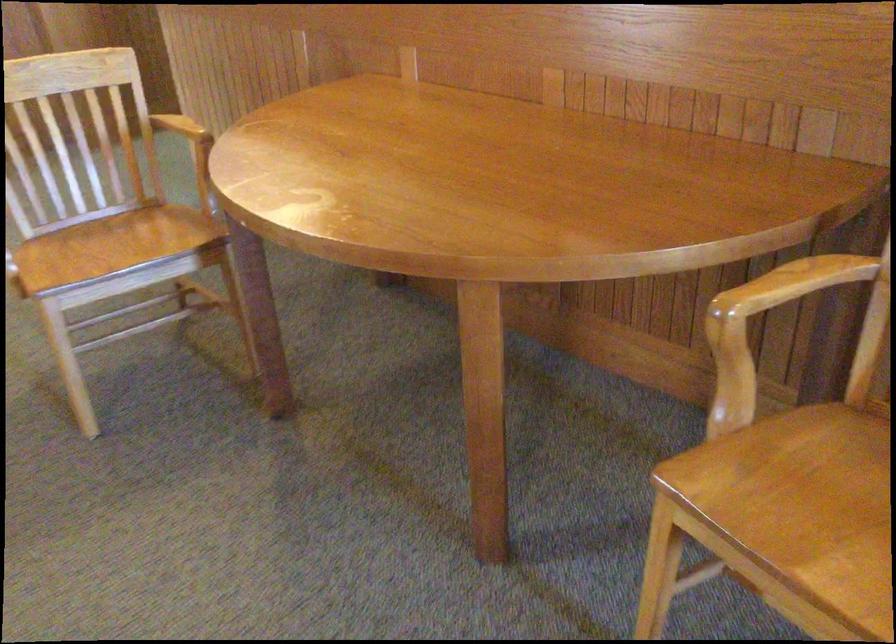
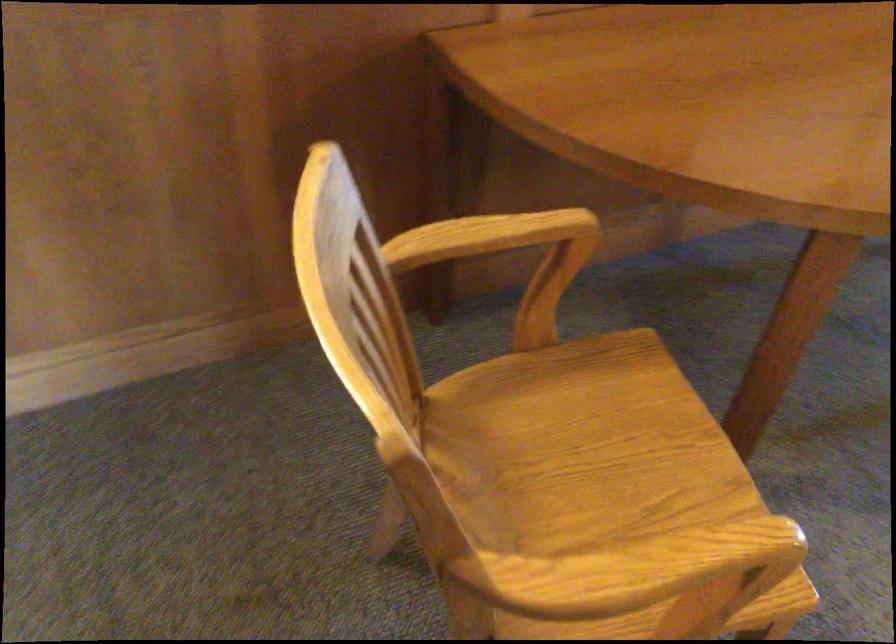
Find the pixel in the second image that matches the point at 167,122 in the first image.

(488, 237)